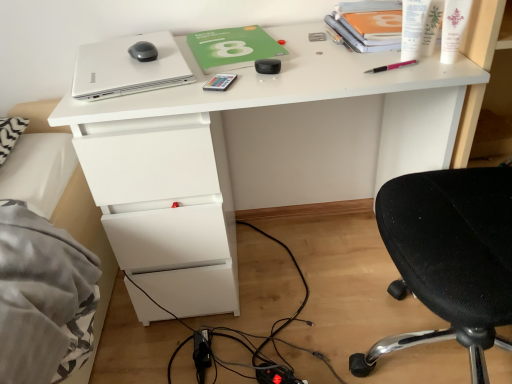
You are a GUI agent. You are given a task and a screenshot of the screen. Output one action in this format:
    pyautogui.click(x=<x>, y=<y>)
    Task: Click on the free space in front of white plastic pen at upper right, the 2th stationery from the right
    The image size is (512, 384).
    Given the screenshot: What is the action you would take?
    pyautogui.click(x=420, y=72)